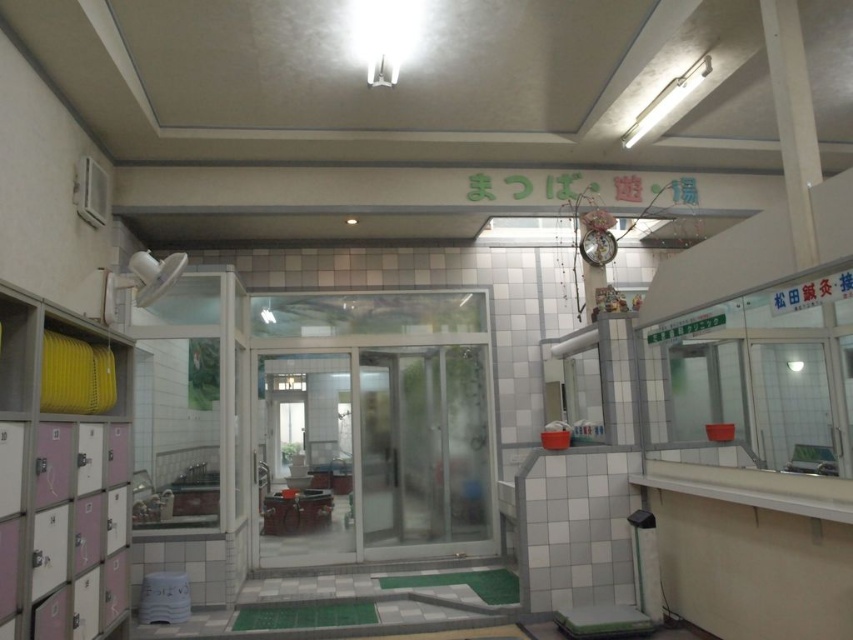
Is pink matte locker at left to the left of transparent plastic screen door at center from the viewer's perspective?

Correct, you'll find pink matte locker at left to the left of transparent plastic screen door at center.

Is point (55, 568) positioned behind point (490, 477)?

No, (55, 568) is in front of (490, 477).

Find the location of a particular element. The image size is (853, 640). pink matte locker at left is located at coordinates (61, 474).